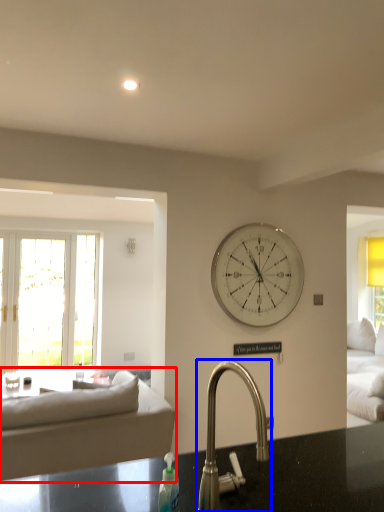
Question: Which object is further to the camera taking this photo, studio couch (highlighted by a red box) or tap (highlighted by a blue box)?

Choices:
 (A) studio couch
 (B) tap

Answer: (A)